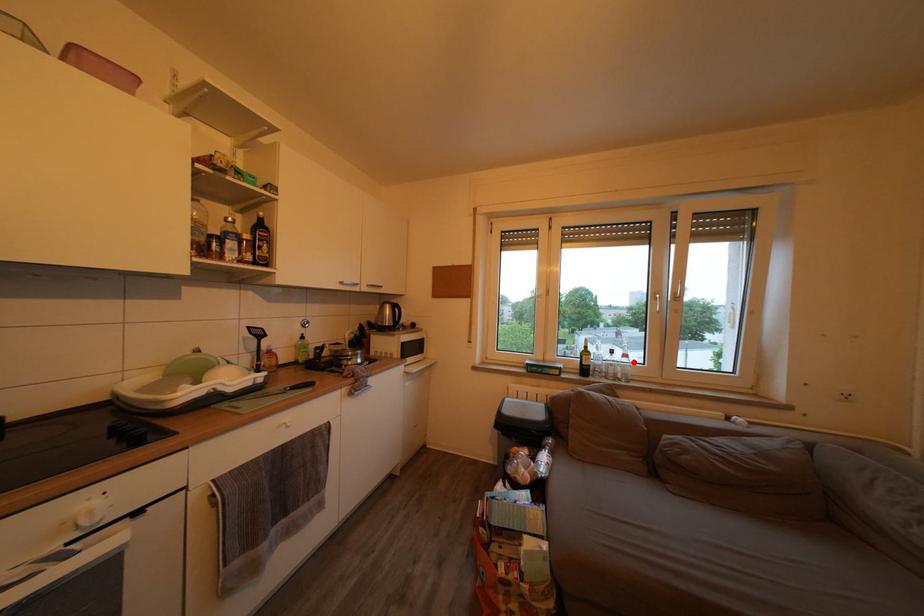
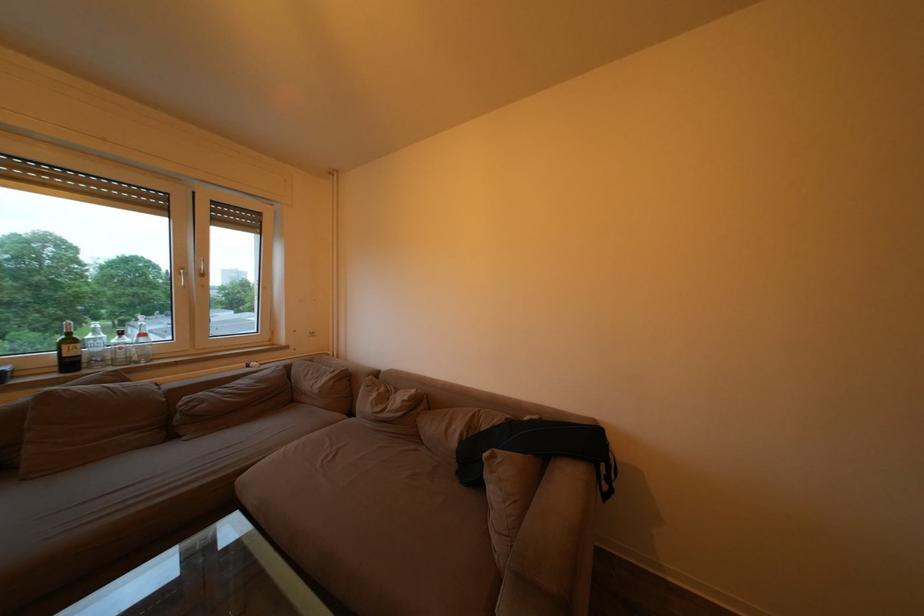
Locate, in the second image, the point that corresponds to the highlighted location in the first image.

(151, 341)